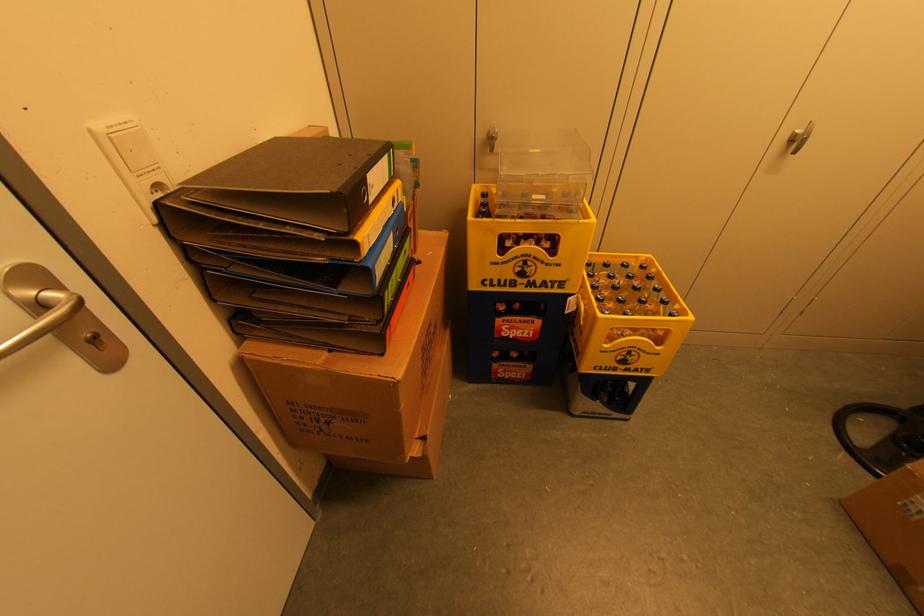
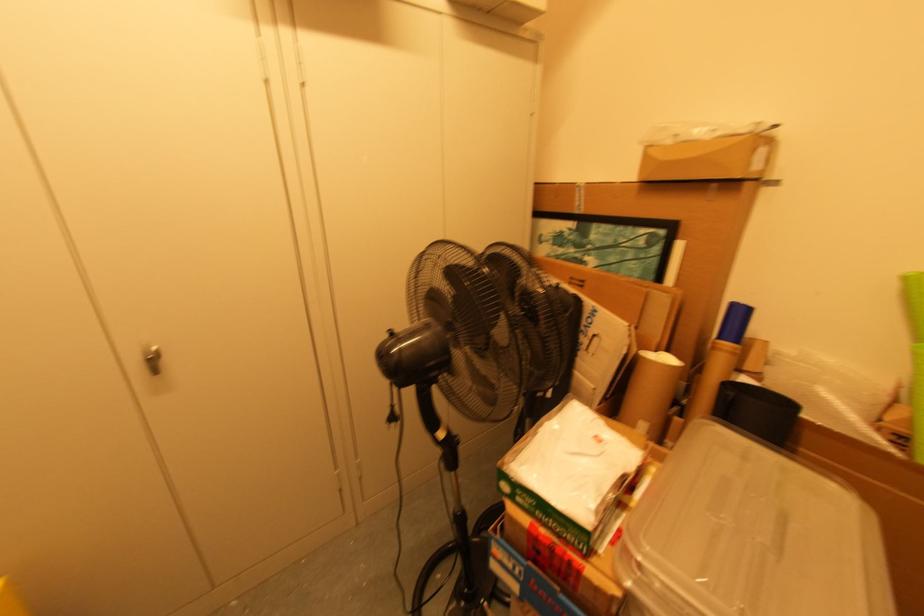
Locate, in the second image, the point that corresponds to pixel 798 142 in the first image.

(152, 361)